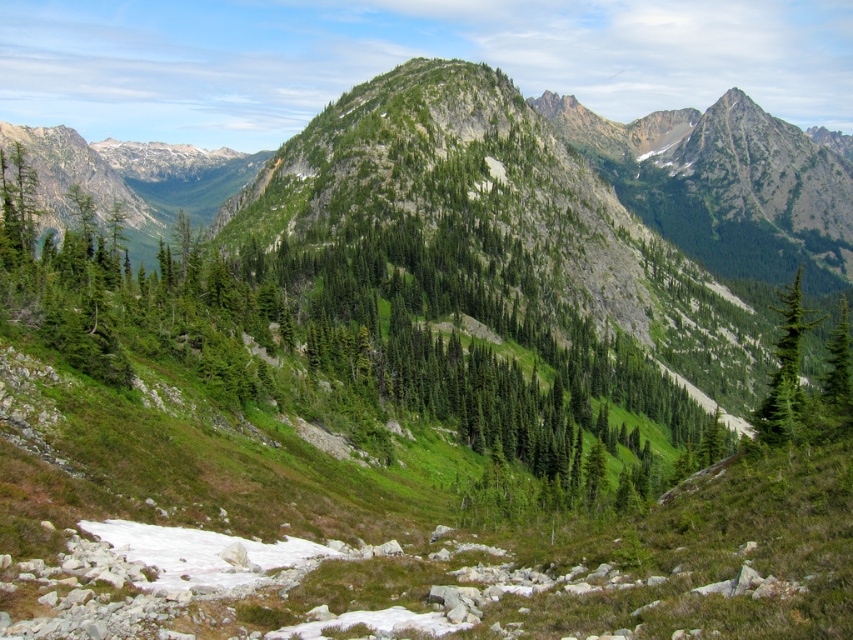
Question: Does green textured tree at right appear on the right side of green matte tree at right?

Choices:
 (A) yes
 (B) no

Answer: (A)

Question: Which is nearer to the green textured tree at right?

Choices:
 (A) green matte tree at right
 (B) green textured tree at center

Answer: (A)

Question: Which of the following is the farthest from the observer?

Choices:
 (A) (79, 192)
 (B) (834, 330)
 (C) (798, 356)

Answer: (A)

Question: Which object is positioned closest to the green textured tree at right?

Choices:
 (A) green textured tree at center
 (B) green matte tree at right

Answer: (B)

Question: Is the position of green textured tree at right less distant than that of green matte tree at right?

Choices:
 (A) yes
 (B) no

Answer: (B)

Question: Can you confirm if green textured tree at center is thinner than green textured tree at right?

Choices:
 (A) no
 (B) yes

Answer: (A)